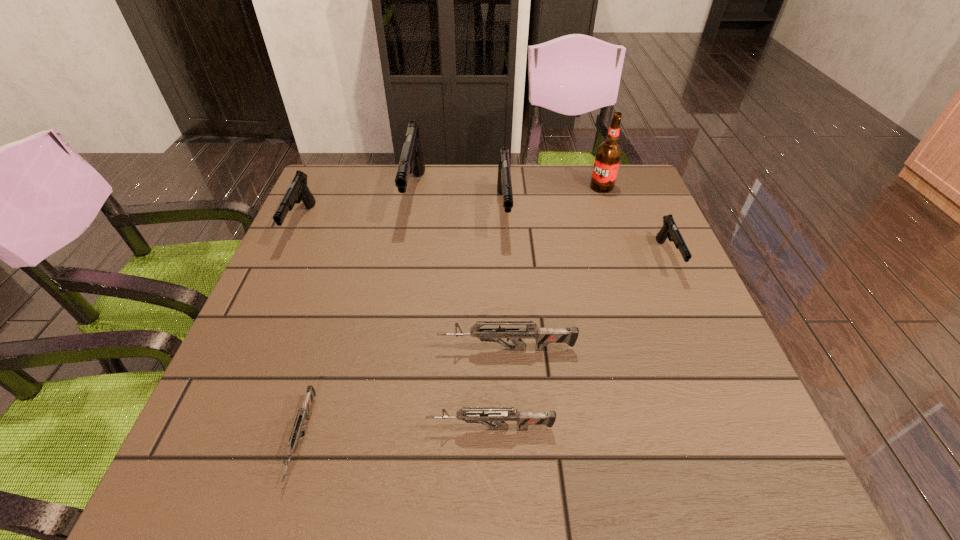
Image resolution: width=960 pixels, height=540 pixels. What are the coordinates of `root beer that is at the right edge` in the screenshot? It's located at (608, 155).

Locate an element on the screen. The width and height of the screenshot is (960, 540). gun at the right edge is located at coordinates (669, 230).

This screenshot has height=540, width=960. In order to click on object present at the far left corner in this screenshot , I will do `click(298, 189)`.

Find the location of a particular element. The image size is (960, 540). object that is at the far right corner is located at coordinates (608, 155).

The image size is (960, 540). Identify the location of vacant space at the far edge of the desktop. (457, 177).

Find the location of a particular element. The width and height of the screenshot is (960, 540). free spot at the near edge of the desktop is located at coordinates (509, 474).

The height and width of the screenshot is (540, 960). Find the location of `vacant space at the left edge`. vacant space at the left edge is located at coordinates (301, 232).

Find the location of a particular element. Image resolution: width=960 pixels, height=540 pixels. vacant region at the right edge of the desktop is located at coordinates (609, 232).

The height and width of the screenshot is (540, 960). I want to click on vacant space at the near left corner of the desktop, so point(285,457).

In the image, there is a desktop. Where is `vacant space at the far right corner`? vacant space at the far right corner is located at coordinates (620, 206).